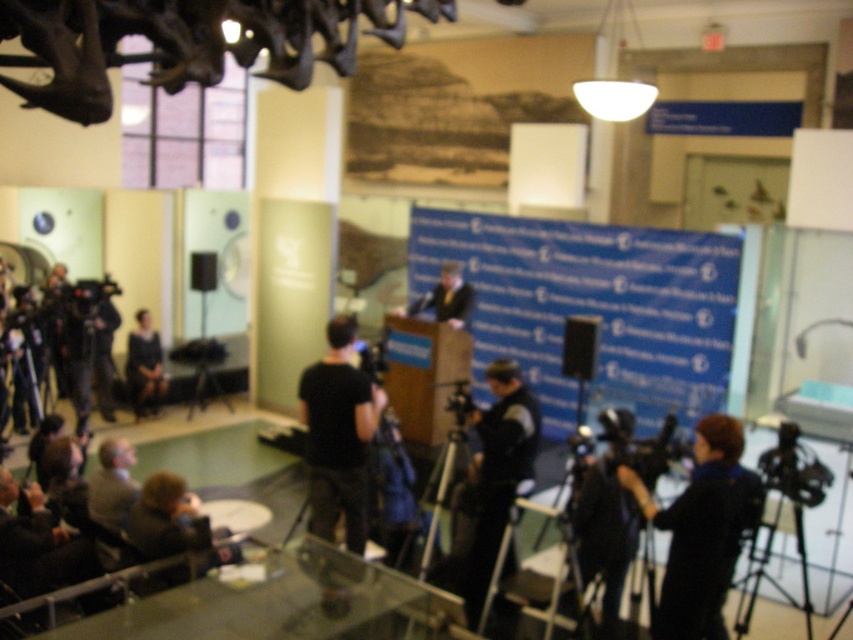
Where is `black cotton shirt at center`? The width and height of the screenshot is (853, 640). black cotton shirt at center is located at coordinates (338, 435).

Between point (311, 451) and point (494, 460), which one is positioned in front?

Point (494, 460) is in front.

Locate an element on the screen. The height and width of the screenshot is (640, 853). black cotton shirt at center is located at coordinates (338, 435).

Is dark blue coat at lower right above dark fabric dress at center?

No, dark blue coat at lower right is not above dark fabric dress at center.

Is dark blue coat at lower right to the left of dark fabric dress at center from the viewer's perspective?

In fact, dark blue coat at lower right is to the right of dark fabric dress at center.

Does point (711, 474) lie in front of point (152, 332)?

Yes, it is.

Find the location of a particular element. The image size is (853, 640). dark blue coat at lower right is located at coordinates (705, 532).

I want to click on black cotton shirt at center, so click(x=338, y=435).

Measure the distance between point (x=358, y=387) and camera.

Point (x=358, y=387) and camera are 15.14 feet apart.

Find the location of `black cotton shirt at center`. black cotton shirt at center is located at coordinates (338, 435).